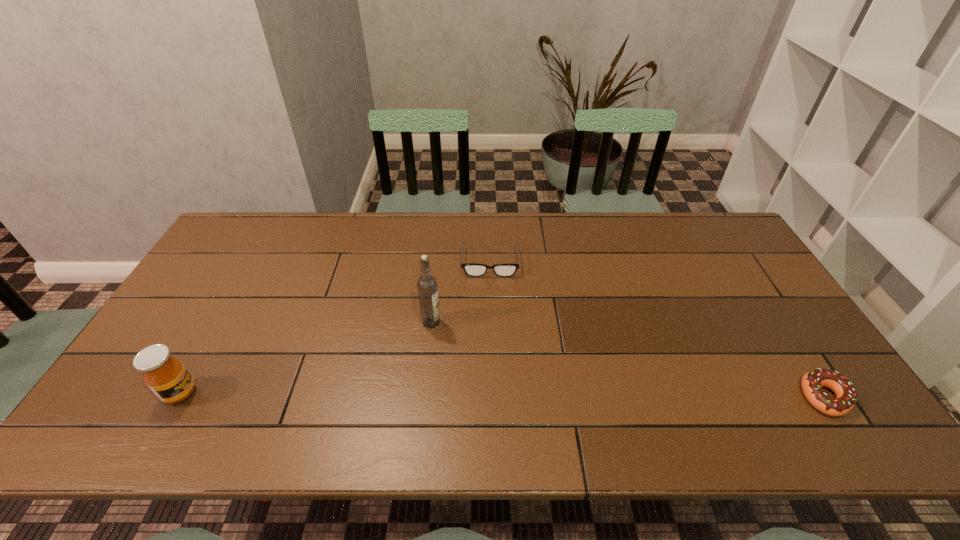
Where is `honey`? honey is located at coordinates coord(167,377).

Locate an element on the screen. This screenshot has height=540, width=960. the second tallest object is located at coordinates (167, 377).

This screenshot has height=540, width=960. Find the location of `the rightmost object`. the rightmost object is located at coordinates (812, 382).

Where is `the third nearest object`? This screenshot has width=960, height=540. the third nearest object is located at coordinates (427, 288).

Where is `vodka`? vodka is located at coordinates (427, 288).

Where is `the farthest object`? The image size is (960, 540). the farthest object is located at coordinates (471, 269).

Locate an element on the screen. This screenshot has height=540, width=960. spectacles is located at coordinates (x=471, y=269).

The image size is (960, 540). Identify the location of free space located on the front-facing side of the leftmost object. (242, 393).

Find the location of `vacant space located on the back of the doughnut`. vacant space located on the back of the doughnut is located at coordinates (751, 282).

Identify the location of free location located 0.320m on the label of the tallest object. Image resolution: width=960 pixels, height=540 pixels. (523, 402).